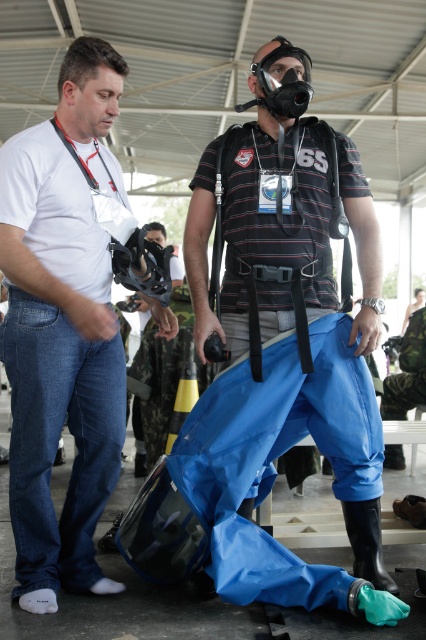
Question: Observing the image, what is the correct spatial positioning of blue rubber pants at center in reference to white matte shirt at left?

Choices:
 (A) right
 (B) left

Answer: (A)

Question: Which of the following is the closest to the observer?

Choices:
 (A) (206, 221)
 (B) (109, 477)

Answer: (B)

Question: Does blue rubber pants at center have a smaller size compared to white matte shirt at left?

Choices:
 (A) yes
 (B) no

Answer: (A)

Question: From the image, what is the correct spatial relationship of blue rubber pants at center in relation to white matte shirt at left?

Choices:
 (A) left
 (B) right

Answer: (B)